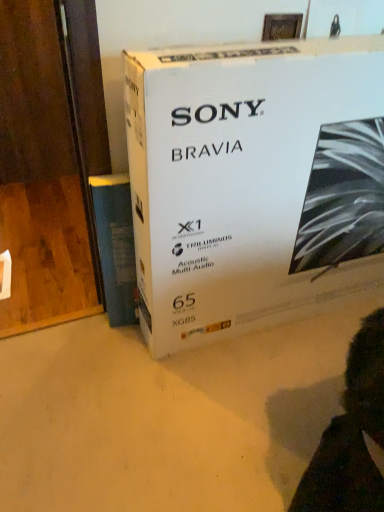
Find the location of a particular element. The image size is (384, 512). blue paper at left is located at coordinates (116, 246).

What is the approximate height of blue paper at left?

blue paper at left is 24.99 inches tall.

Describe the element at coordinates (116, 246) in the screenshot. Image resolution: width=384 pixels, height=512 pixels. I see `blue paper at left` at that location.

Measure the distance between point (106, 274) and camera.

They are 1.43 meters apart.

The height and width of the screenshot is (512, 384). In order to click on white cardboard box at center in this screenshot , I will do click(253, 182).

What do you see at coordinates (253, 182) in the screenshot?
I see `white cardboard box at center` at bounding box center [253, 182].

At what (x,y) coordinates should I click in order to perform the action: click on blue paper at left. Please return your answer as a coordinate pair (x, y). This screenshot has height=512, width=384. Looking at the image, I should click on (116, 246).

Which object is positioned more to the left, blue paper at left or white cardboard box at center?

From the viewer's perspective, blue paper at left appears more on the left side.

Does blue paper at left come behind white cardboard box at center?

Yes, blue paper at left is further from the camera.

Which point is more distant from viewer, (101, 258) or (194, 170)?

The point (101, 258) is more distant.

From the image's perspective, is blue paper at left positioned above or below white cardboard box at center?

blue paper at left is situated lower than white cardboard box at center in the image.

From a real-world perspective, relative to white cardboard box at center, is blue paper at left vertically above or below?

In terms of real-world spatial position, blue paper at left is below white cardboard box at center.

Can you confirm if blue paper at left is wider than white cardboard box at center?

In fact, blue paper at left might be narrower than white cardboard box at center.

Between blue paper at left and white cardboard box at center, which one has more height?

With more height is white cardboard box at center.

Considering the relative sizes of blue paper at left and white cardboard box at center in the image provided, is blue paper at left smaller than white cardboard box at center?

Yes, blue paper at left is smaller than white cardboard box at center.

Is white cardboard box at center inside blue paper at left?

No, white cardboard box at center is not surrounded by blue paper at left.

Is blue paper at left in contact with white cardboard box at center?

There is a gap between blue paper at left and white cardboard box at center.

Could you tell me if blue paper at left is turned towards white cardboard box at center?

No.

In the image, there is a blue paper at left. Identify the location of box above it (from the image's perspective). The width and height of the screenshot is (384, 512). (253, 182).

Is white cardboard box at center to the left of blue paper at left from the viewer's perspective?

In fact, white cardboard box at center is to the right of blue paper at left.

In the scene shown: Between white cardboard box at center and blue paper at left, which one is positioned behind?

blue paper at left is more distant.

Considering the points (158, 77) and (109, 182), which point is behind, point (158, 77) or point (109, 182)?

The point (109, 182) is more distant.

Based on the photo, from the image's perspective, is white cardboard box at center above or below blue paper at left?

white cardboard box at center is situated higher than blue paper at left in the image.

From a real-world perspective, is white cardboard box at center on blue paper at left?

Yes, from a real-world perspective, white cardboard box at center is over blue paper at left

Which of these two, white cardboard box at center or blue paper at left, is wider?

With larger width is white cardboard box at center.

Does white cardboard box at center have a greater height compared to blue paper at left?

Correct, white cardboard box at center is much taller as blue paper at left.

Based on the photo, is white cardboard box at center smaller than blue paper at left?

No, white cardboard box at center is not smaller than blue paper at left.

Is white cardboard box at center surrounding blue paper at left?

Actually, blue paper at left is outside white cardboard box at center.

Is white cardboard box at center not near blue paper at left?

They are positioned close to each other.

Could you tell me if white cardboard box at center is turned towards blue paper at left?

No, white cardboard box at center does not turn towards blue paper at left.

How far apart are white cardboard box at center and blue paper at left?

white cardboard box at center and blue paper at left are 37.81 centimeters apart.

Locate an element on the screen. box above the blue paper at left (from the image's perspective) is located at coordinates (253, 182).

Find the location of a particular element. This screenshot has height=512, width=384. box that is in front of the blue paper at left is located at coordinates (253, 182).

Identify the location of box above the blue paper at left (from the image's perspective). (253, 182).